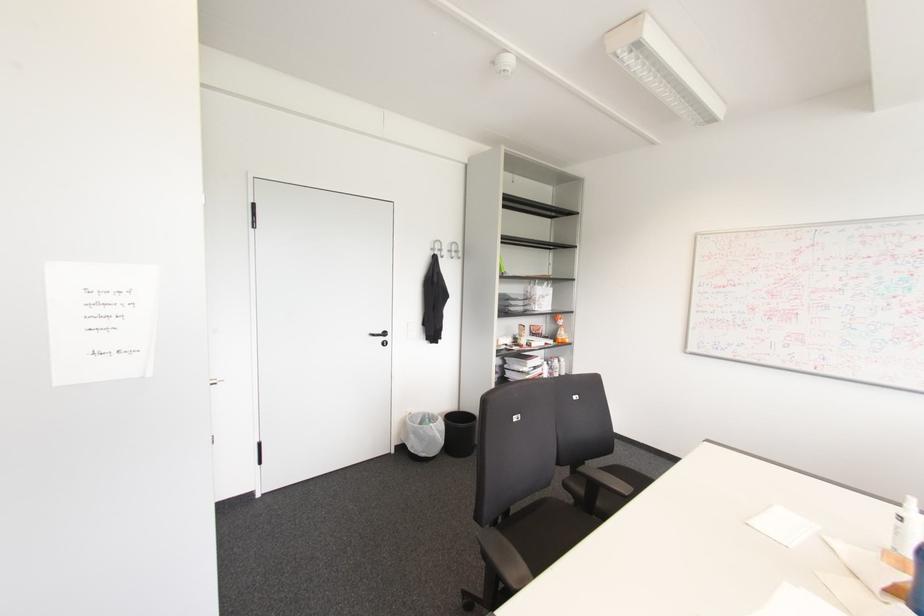
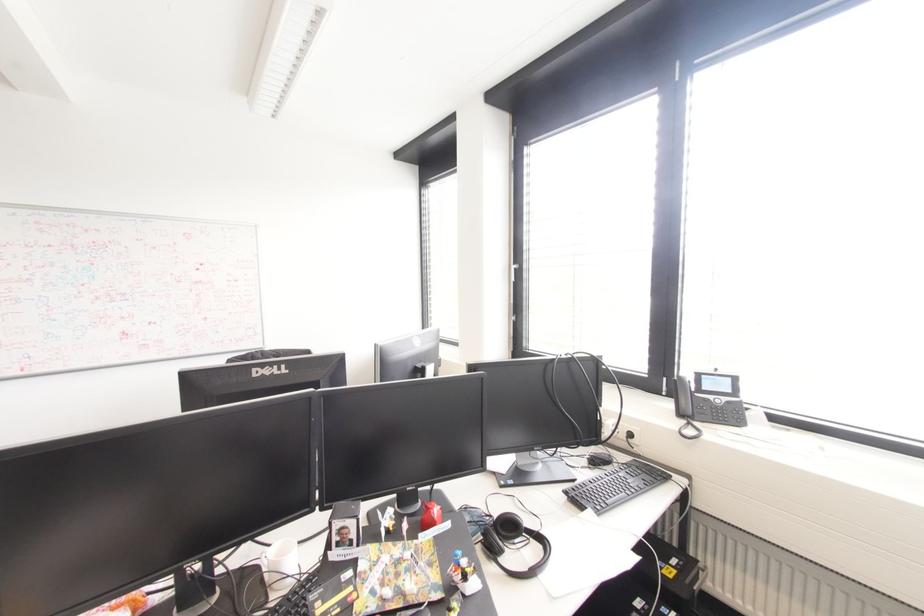
Question: The camera is either moving clockwise (left) or counter-clockwise (right) around the object. The first image is from the beginning of the video and the second image is from the end. Is the camera moving left or right when shooting the video?

Choices:
 (A) Left
 (B) Right

Answer: (A)